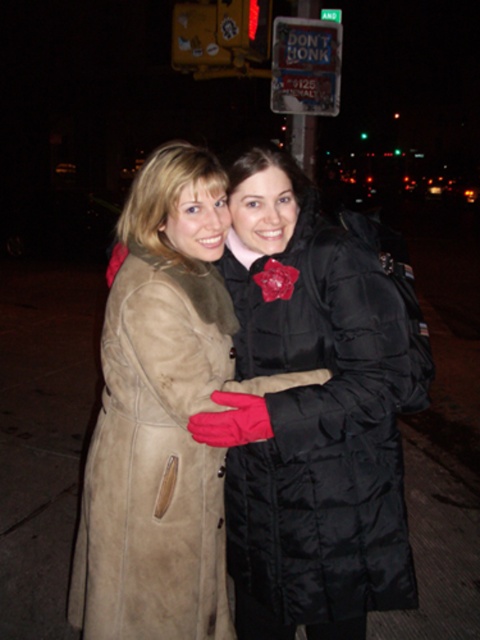
Who is higher up, suede coat at left or velvet black coat at center?

velvet black coat at center

Is suede coat at left below velvet black coat at center?

Correct, suede coat at left is located below velvet black coat at center.

Is point (175, 605) positioned behind point (135, 234)?

No, it is not.

You are a GUI agent. You are given a task and a screenshot of the screen. Output one action in this format:
    pyautogui.click(x=<x>, y=<y>)
    Task: Click on the suede coat at left
    
    Given the screenshot: What is the action you would take?
    pyautogui.click(x=156, y=461)

Image resolution: width=480 pixels, height=640 pixels. In order to click on suede coat at center in this screenshot , I will do `click(245, 413)`.

Who is more distant from viewer, [267,484] or [315,36]?

Point [315,36]

At what (x,y) coordinates should I click in order to perform the action: click on suede coat at center. Please return your answer as a coordinate pair (x, y). Looking at the image, I should click on (245, 413).

Can you confirm if velvet black coat at center is positioned to the left of metallic blue sign at upper center?

Indeed, velvet black coat at center is positioned on the left side of metallic blue sign at upper center.

Image resolution: width=480 pixels, height=640 pixels. What do you see at coordinates (165, 195) in the screenshot? I see `velvet black coat at center` at bounding box center [165, 195].

You are a GUI agent. You are given a task and a screenshot of the screen. Output one action in this format:
    pyautogui.click(x=<x>, y=<y>)
    Task: Click on the velvet black coat at center
    
    Given the screenshot: What is the action you would take?
    pyautogui.click(x=165, y=195)